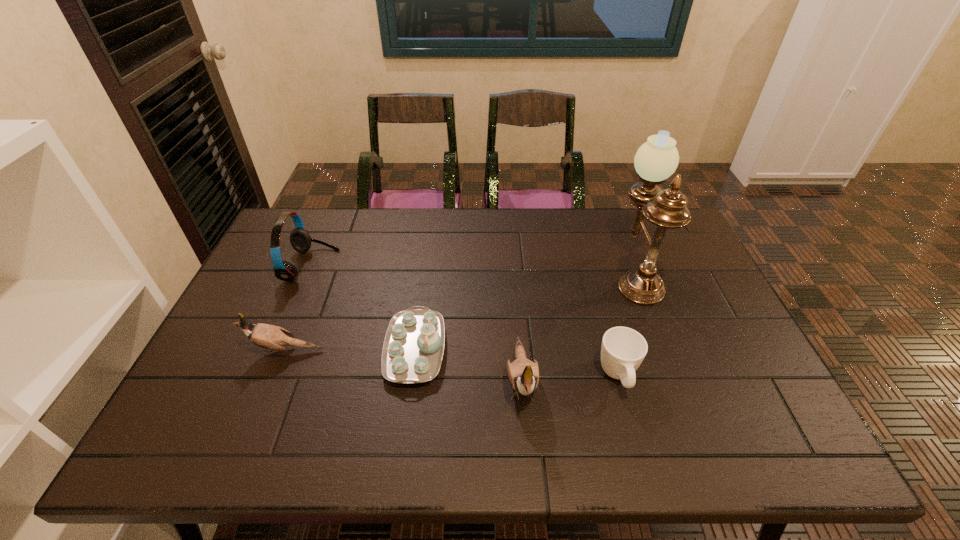
This screenshot has height=540, width=960. Find the location of `object present at the right edge`. object present at the right edge is located at coordinates (657, 159).

Find the location of a particular element. This screenshot has width=960, height=540. object at the far left corner is located at coordinates (300, 239).

This screenshot has height=540, width=960. I want to click on object that is at the far right corner, so click(657, 159).

In the image, there is a desktop. Identify the location of vacant space at the far edge. Image resolution: width=960 pixels, height=540 pixels. (373, 235).

Locate an element on the screen. Image resolution: width=960 pixels, height=540 pixels. vacant region at the near edge is located at coordinates (330, 402).

Where is `vacant space at the left edge of the desktop`? The width and height of the screenshot is (960, 540). vacant space at the left edge of the desktop is located at coordinates (230, 356).

Find the location of `vacant area at the right edge`. vacant area at the right edge is located at coordinates (686, 336).

Locate an element on the screen. The image size is (960, 540). vacant position at the near left corner of the desktop is located at coordinates (193, 397).

Find the location of a particular element. vacant area at the far right corner of the desktop is located at coordinates (682, 231).

The height and width of the screenshot is (540, 960). What are the coordinates of `vacant area at the near right corner of the desktop` in the screenshot? It's located at (756, 392).